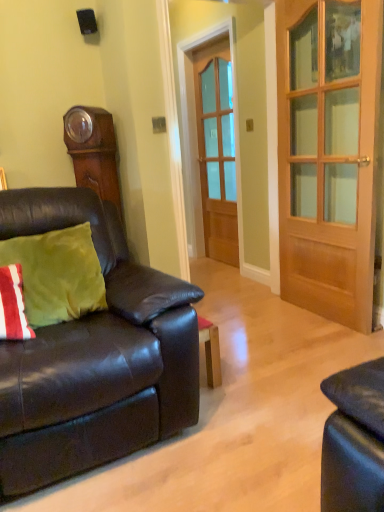
Where is `free space on the front side of wooden door at center, which is the first door from front to back`? The image size is (384, 512). free space on the front side of wooden door at center, which is the first door from front to back is located at coordinates (316, 344).